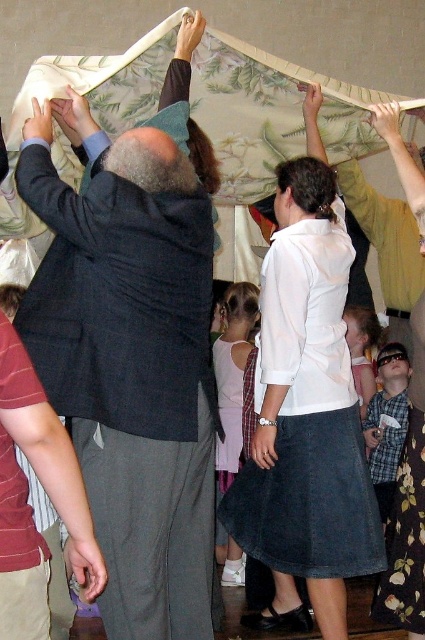
Question: Which of these objects is positioned closest to the dark gray wool suit at upper left?

Choices:
 (A) maroon striped shirt at lower left
 (B) plaid shirt at center
 (C) white cotton dress at center

Answer: (A)

Question: Does white cotton shirt at center appear on the left side of floral print dress at lower right?

Choices:
 (A) no
 (B) yes

Answer: (B)

Question: Can you confirm if white cotton dress at center is positioned above plaid shirt at center?

Choices:
 (A) no
 (B) yes

Answer: (B)

Question: Which object is closer to the camera taking this photo?

Choices:
 (A) dark gray wool suit at upper left
 (B) maroon striped shirt at lower left

Answer: (B)

Question: Among these points, which one is farthest from the camera?

Choices:
 (A) (306, 209)
 (B) (390, 604)

Answer: (B)

Question: Observing the image, what is the correct spatial positioning of dark gray wool suit at upper left in reference to plaid shirt at center?

Choices:
 (A) right
 (B) left

Answer: (B)